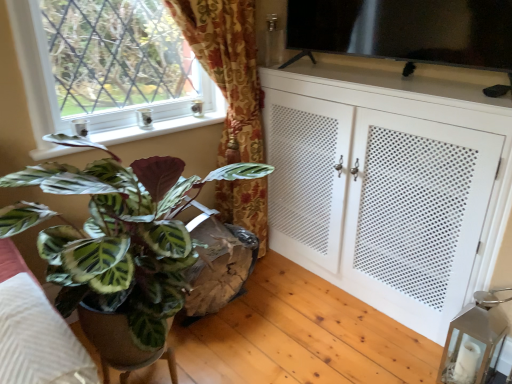
Question: Is white glossy window sill at upper left taller or shorter than white perforated cabinet at right?

Choices:
 (A) short
 (B) tall

Answer: (A)

Question: Relative to white perforated cabinet at right, is white glossy window sill at upper left in front or behind?

Choices:
 (A) front
 (B) behind

Answer: (B)

Question: Estimate the real-world distances between objects in this image. Which object is farther from the white perforated cabinet at right?

Choices:
 (A) white glossy window sill at upper left
 (B) metallic glass lantern at lower right
 (C) green marbled leaf at left
 (D) green leafy plant at lower left
 (E) transparent glass tv at upper right

Answer: (D)

Question: Estimate the real-world distances between objects in this image. Which object is farther from the transparent glass tv at upper right?

Choices:
 (A) green leafy plant at lower left
 (B) metallic glass lantern at lower right
 (C) white perforated cabinet at right
 (D) white glossy window sill at upper left
 (E) green marbled leaf at left

Answer: (A)